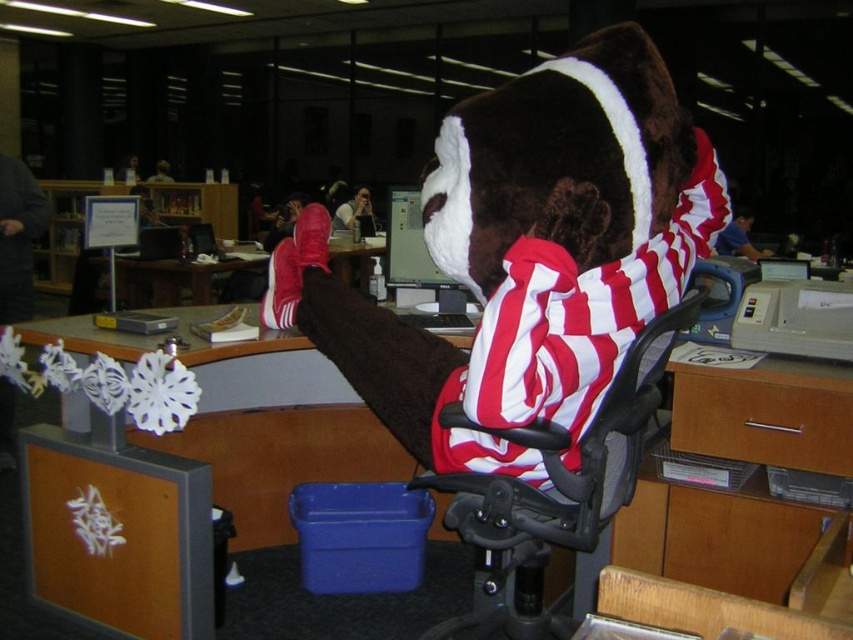
From the picture: Can you confirm if black mesh chair at center is shorter than black mesh swivel chair at center?

In fact, black mesh chair at center may be taller than black mesh swivel chair at center.

Can you confirm if black mesh chair at center is taller than black mesh swivel chair at center?

Indeed, black mesh chair at center has a greater height compared to black mesh swivel chair at center.

What are the coordinates of `black mesh chair at center` in the screenshot? It's located at (555, 488).

Measure the distance between point (601, 602) and camera.

Point (601, 602) is 79.65 centimeters from camera.

Consider the image. Is black mesh swivel chair at center further to the viewer compared to matte plastic desk at center?

No, it is in front of matte plastic desk at center.

Measure the distance between point (793,624) and camera.

Point (793,624) and camera are 28.43 inches apart.

This screenshot has height=640, width=853. I want to click on black mesh swivel chair at center, so click(692, 612).

Between black mesh chair at center and matte plastic desk at center, which one has less height?

matte plastic desk at center is shorter.

The image size is (853, 640). Identify the location of black mesh chair at center. coord(555,488).